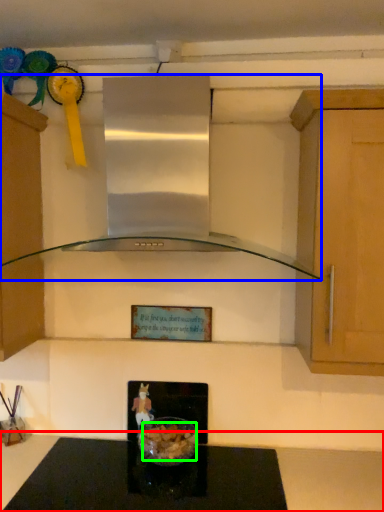
Question: Which object is the farthest from countertop (highlighted by a red box)? Choose among these: home appliance (highlighted by a blue box) or food (highlighted by a green box).

Choices:
 (A) home appliance
 (B) food

Answer: (A)